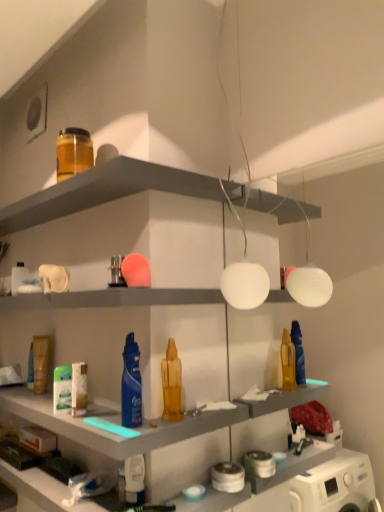
What do you see at coordinates (73, 152) in the screenshot? I see `translucent amber jar at upper left, which ranks as the 6th toiletry in bottom-to-top order` at bounding box center [73, 152].

In the scene shown: How much space does translucent amber jar at upper left, which appears as the 5th toiletry when viewed from the front, occupy vertically?

It is 14.85 centimeters.

This screenshot has height=512, width=384. In order to click on blue glossy hair spray at center in this screenshot , I will do `click(131, 385)`.

What do you see at coordinates (131, 385) in the screenshot? This screenshot has height=512, width=384. I see `blue glossy hair spray at center` at bounding box center [131, 385].

Where is `white glossy lotion at lower center, which is counted as the sixth toiletry, starting from the back`? white glossy lotion at lower center, which is counted as the sixth toiletry, starting from the back is located at coordinates tap(134, 479).

What do you see at coordinates (134, 479) in the screenshot? The image size is (384, 512). I see `white glossy lotion at lower center, arranged as the 2th toiletry when viewed from the right` at bounding box center [134, 479].

Identify the location of translucent amber jar at upper left, which is the 2th toiletry from back to front. (73, 152).

Is matte plastic shelf at upper center directly adjacent to blue glossy hair spray at center?

No, matte plastic shelf at upper center is not with blue glossy hair spray at center.

From a real-world perspective, is matte plastic shelf at upper center located higher than blue glossy hair spray at center?

Yes, from a real-world perspective, matte plastic shelf at upper center is above blue glossy hair spray at center.

What's the angular difference between matte plastic shelf at upper center and blue glossy hair spray at center's facing directions?

There is a 0.00284-degree angle between the facing directions of matte plastic shelf at upper center and blue glossy hair spray at center.

Is matte plastic shelf at upper center thinner than blue glossy hair spray at center?

In fact, matte plastic shelf at upper center might be wider than blue glossy hair spray at center.

Which is correct: translucent amber jar at upper left, placed as the 5th toiletry when sorted from right to left, is inside blue glossy hair spray at center, or outside of it?

The correct answer is: outside.

Is translucent amber jar at upper left, which is counted as the 1th toiletry, starting from the top, in front of or behind blue glossy hair spray at center in the image?

In the image, translucent amber jar at upper left, which is counted as the 1th toiletry, starting from the top, appears behind blue glossy hair spray at center.

Which of these two, translucent amber jar at upper left, which is counted as the 1th toiletry, starting from the top, or blue glossy hair spray at center, is wider?

translucent amber jar at upper left, which is counted as the 1th toiletry, starting from the top.

Considering the sizes of white matte tube at center, arranged as the 3th toiletry when ordered from the bottom, and wooden container at left, the 1th toiletry from the back, in the image, is white matte tube at center, arranged as the 3th toiletry when ordered from the bottom, bigger or smaller than wooden container at left, the 1th toiletry from the back,?

white matte tube at center, arranged as the 3th toiletry when ordered from the bottom, is smaller than wooden container at left, the 1th toiletry from the back.

Can you confirm if white matte tube at center, which ranks as the 4th toiletry in right-to-left order, is wider than wooden container at left, positioned as the 5th toiletry in top-to-bottom order?

No, white matte tube at center, which ranks as the 4th toiletry in right-to-left order, is not wider than wooden container at left, positioned as the 5th toiletry in top-to-bottom order.

From a real-world perspective, is white matte tube at center, which ranks as the 4th toiletry in right-to-left order, under wooden container at left, the 1th toiletry from the back?

Yes, from a real-world perspective, white matte tube at center, which ranks as the 4th toiletry in right-to-left order, is under wooden container at left, the 1th toiletry from the back.

Is white matte tube at center, arranged as the 3th toiletry when ordered from the bottom, oriented away from wooden container at left, the first toiletry from the left?

No, wooden container at left, the first toiletry from the left, is not at the back of white matte tube at center, arranged as the 3th toiletry when ordered from the bottom.

Is translucent amber bottle at center, marked as the fourth toiletry in a bottom-to-top arrangement, located outside matte plastic shelf at upper center?

Absolutely, translucent amber bottle at center, marked as the fourth toiletry in a bottom-to-top arrangement, is external to matte plastic shelf at upper center.

Is translucent amber bottle at center, placed as the 5th toiletry when sorted from back to front, at the right side of matte plastic shelf at upper center?

Indeed, translucent amber bottle at center, placed as the 5th toiletry when sorted from back to front, is positioned on the right side of matte plastic shelf at upper center.

Looking at this image, relative to matte plastic shelf at upper center, is translucent amber bottle at center, acting as the 2th toiletry starting from the front, in front or behind?

In the image, translucent amber bottle at center, acting as the 2th toiletry starting from the front, appears behind matte plastic shelf at upper center.

Considering the relative sizes of translucent amber bottle at center, placed as the 5th toiletry when sorted from back to front, and matte plastic shelf at upper center in the image provided, is translucent amber bottle at center, placed as the 5th toiletry when sorted from back to front, wider than matte plastic shelf at upper center?

No, translucent amber bottle at center, placed as the 5th toiletry when sorted from back to front, is not wider than matte plastic shelf at upper center.

Where is `the 1st toiletry counting from the left of the white glossy lotion at lower center, which appears as the sixth toiletry when viewed from the top`? The image size is (384, 512). the 1st toiletry counting from the left of the white glossy lotion at lower center, which appears as the sixth toiletry when viewed from the top is located at coordinates (116, 272).

Which is behind, point (118, 281) or point (139, 487)?

The point (118, 281) is behind.

From the image's perspective, which object appears higher, metallic silver toiletry at center, the 4th toiletry positioned from the left, or white glossy lotion at lower center, which is counted as the sixth toiletry, starting from the back?

metallic silver toiletry at center, the 4th toiletry positioned from the left, from the image's perspective.

Does metallic silver toiletry at center, marked as the third toiletry in a front-to-back arrangement, come behind white glossy lotion at lower center, which appears as the sixth toiletry when viewed from the top?

That is True.

Is blue glossy hair spray at center thinner than white glossy lotion at lower center, which is counted as the fifth toiletry, starting from the left?

Correct, the width of blue glossy hair spray at center is less than that of white glossy lotion at lower center, which is counted as the fifth toiletry, starting from the left.

Would you say blue glossy hair spray at center is a long distance from white glossy lotion at lower center, the 1th toiletry in the bottom-to-top sequence?

No, blue glossy hair spray at center is not far away from white glossy lotion at lower center, the 1th toiletry in the bottom-to-top sequence.

Choose the correct answer: Is blue glossy hair spray at center inside white glossy lotion at lower center, acting as the first toiletry starting from the front, or outside it?

blue glossy hair spray at center exists outside the volume of white glossy lotion at lower center, acting as the first toiletry starting from the front.

Does blue glossy hair spray at center come in front of white glossy lotion at lower center, the 1th toiletry in the bottom-to-top sequence?

That is True.

Do you think blue glossy hair spray at center is within matte plastic shelf at upper center, or outside of it?

blue glossy hair spray at center is spatially situated outside matte plastic shelf at upper center.

Is point (135, 400) closer or farther from the camera than point (141, 167)?

Clearly, point (135, 400) is closer to the camera than point (141, 167).

From the image's perspective, does blue glossy hair spray at center appear lower than matte plastic shelf at upper center?

Yes, from the image's perspective, blue glossy hair spray at center is below matte plastic shelf at upper center.

In the image, there is a matte plastic shelf at upper center. In order to click on cleaning product below it (from a real-world perspective) in this screenshot , I will do `click(131, 385)`.

Which toiletry is the 3rd one when counting from the left side of the blue glossy hair spray at center? Please provide its 2D coordinates.

[(73, 152)]

Considering their positions, is blue glossy hair spray at center positioned further to white matte light fixture at center than translucent amber bottle at center, which is the 6th toiletry from left to right?

The object further to white matte light fixture at center is blue glossy hair spray at center.

Based on their spatial positions, is white matte light fixture at center or wooden container at left, positioned as the 5th toiletry in top-to-bottom order, closer to blue glossy hair spray at center?

wooden container at left, positioned as the 5th toiletry in top-to-bottom order, is closer to blue glossy hair spray at center.

Looking at the image, which one is located closer to translucent amber bottle at center, positioned as the third toiletry in top-to-bottom order, blue glossy hair spray at center or metallic silver toiletry at center, which is counted as the 5th toiletry, starting from the bottom?

Among the two, blue glossy hair spray at center is located nearer to translucent amber bottle at center, positioned as the third toiletry in top-to-bottom order.

Estimate the real-world distances between objects in this image. Which object is closer to blue glossy hair spray at center, white matte tube at center, arranged as the 3th toiletry when ordered from the bottom, or translucent amber bottle at center, the 1th toiletry viewed from the right?

translucent amber bottle at center, the 1th toiletry viewed from the right.

Estimate the real-world distances between objects in this image. Which object is further from translucent amber bottle at center, acting as the 2th toiletry starting from the front, white matte light fixture at center or wooden container at left, the first toiletry from the left?

Based on the image, white matte light fixture at center appears to be further to translucent amber bottle at center, acting as the 2th toiletry starting from the front.

Based on their spatial positions, is white matte tube at center, acting as the 3th toiletry starting from the left, or white matte light fixture at center closer to white glossy lotion at lower center, acting as the first toiletry starting from the front?

white matte tube at center, acting as the 3th toiletry starting from the left, lies closer to white glossy lotion at lower center, acting as the first toiletry starting from the front, than the other object.

Estimate the real-world distances between objects in this image. Which object is closer to white matte light fixture at center, matte plastic shelf at upper center or blue glossy hair spray at center?

matte plastic shelf at upper center lies closer to white matte light fixture at center than the other object.

Estimate the real-world distances between objects in this image. Which object is further from translucent amber bottle at center, positioned as the third toiletry in top-to-bottom order, matte plastic shelf at upper center or white matte light fixture at center?

white matte light fixture at center.

The height and width of the screenshot is (512, 384). I want to click on cleaning product between translucent amber jar at upper left, which is counted as the 1th toiletry, starting from the top, and white glossy lotion at lower center, acting as the first toiletry starting from the front, from top to bottom, so click(x=131, y=385).

You are a GUI agent. You are given a task and a screenshot of the screen. Output one action in this format:
    pyautogui.click(x=<x>, y=<y>)
    Task: Click on the cleaning product between translucent amber jar at upper left, which appears as the 5th toiletry when viewed from the front, and white matte tube at center, acting as the 3th toiletry starting from the left, in the vertical direction
    This screenshot has width=384, height=512.
    Given the screenshot: What is the action you would take?
    pos(131,385)

The height and width of the screenshot is (512, 384). In order to click on cleaning product that lies between white matte light fixture at center and white glossy lotion at lower center, arranged as the 2th toiletry when viewed from the right, from top to bottom in this screenshot , I will do `click(131, 385)`.

Find the location of `cleaning product between wooden container at left, acting as the sixth toiletry starting from the front, and translucent amber bottle at center, acting as the 2th toiletry starting from the front, in the horizontal direction`. cleaning product between wooden container at left, acting as the sixth toiletry starting from the front, and translucent amber bottle at center, acting as the 2th toiletry starting from the front, in the horizontal direction is located at coordinates (131, 385).